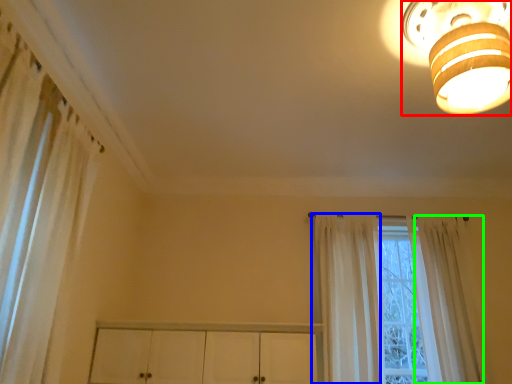
Question: Which is farther away from lamp (highlighted by a red box)? curtain (highlighted by a blue box) or curtain (highlighted by a green box)?

Choices:
 (A) curtain
 (B) curtain

Answer: (B)